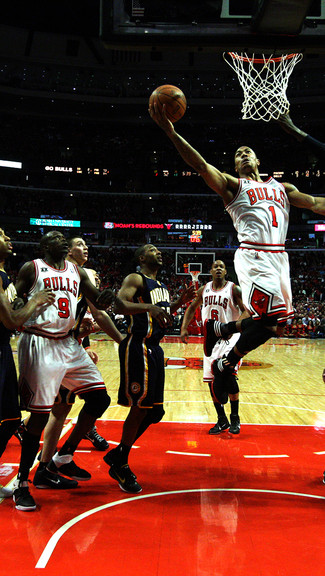
This screenshot has height=576, width=325. In order to click on red floor in this screenshot , I will do `click(214, 484)`, `click(192, 361)`, `click(194, 338)`.